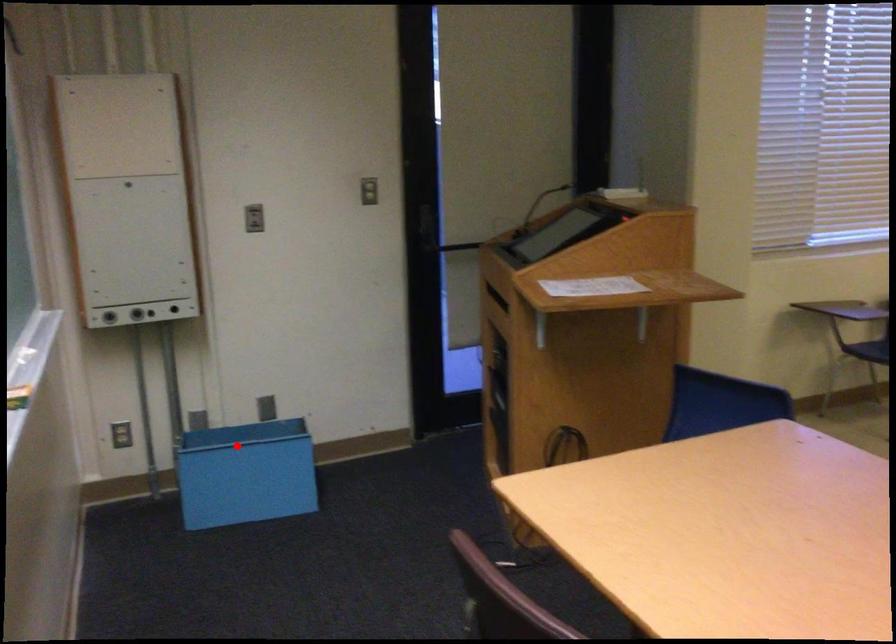
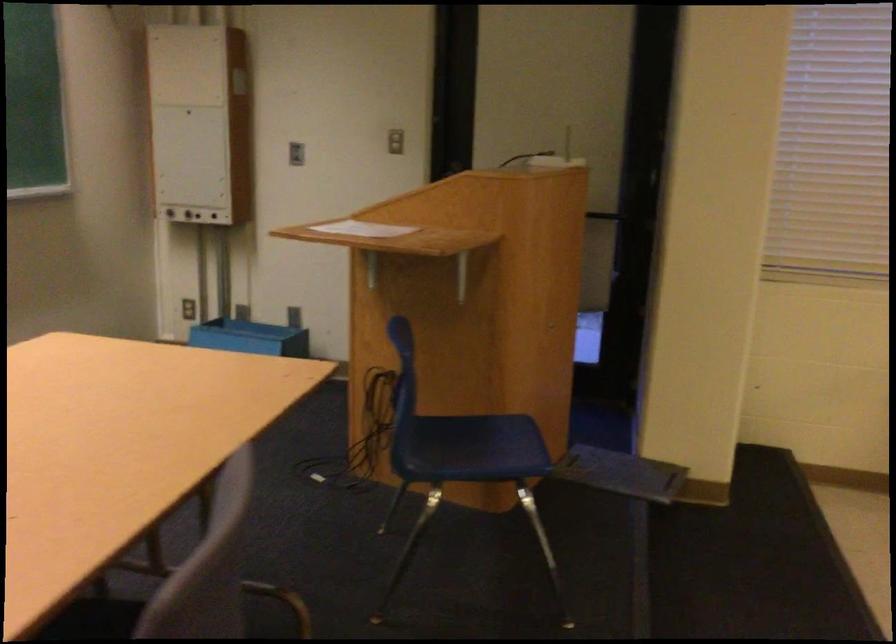
Find the pixel in the second image that matches the highlighted location in the first image.

(250, 337)